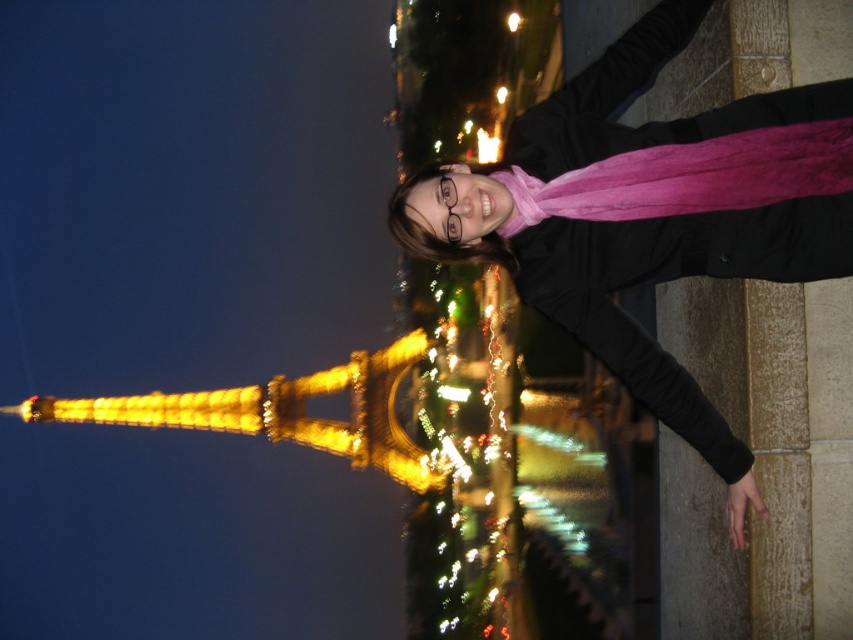
Question: Which point is closer to the camera taking this photo?

Choices:
 (A) (706, 250)
 (B) (457, 349)
 (C) (374, 412)

Answer: (A)

Question: Can you confirm if golden illuminated eiffel tower at center is positioned to the left of golden illuminated tower at left?

Choices:
 (A) yes
 (B) no

Answer: (B)

Question: Which is nearer to the pink velvet scarf at upper right?

Choices:
 (A) golden illuminated eiffel tower at center
 (B) golden illuminated tower at left

Answer: (A)

Question: Can you confirm if pink velvet scarf at upper right is positioned to the right of golden illuminated tower at left?

Choices:
 (A) yes
 (B) no

Answer: (A)

Question: Which of these objects is positioned farthest from the pink velvet scarf at upper right?

Choices:
 (A) golden illuminated tower at left
 (B) golden illuminated eiffel tower at center

Answer: (A)

Question: From the image, what is the correct spatial relationship of pink velvet scarf at upper right in relation to golden illuminated eiffel tower at center?

Choices:
 (A) left
 (B) right

Answer: (B)